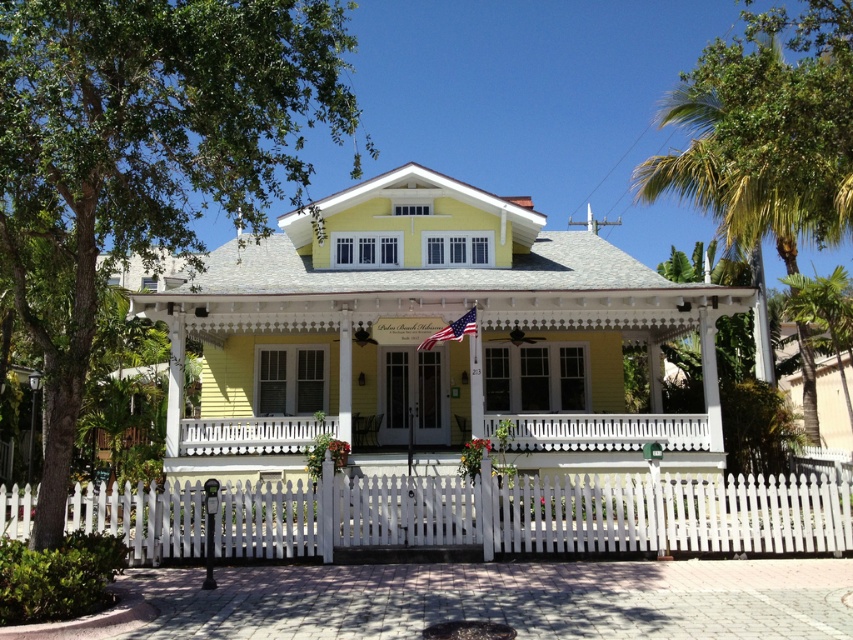
You are standing on the porch of the house and want to place a birdhouse between the green leafy palm tree at upper right and the green leafy palm tree at right. Which palm tree should you place the birdhouse closer to if you want it to be lower?

The green leafy palm tree at right is lower than the green leafy palm tree at upper right, so placing the birdhouse closer to the green leafy palm tree at right would make it lower.

You are a painter who needs to place a ladder on the white wooden porch at center to paint the house. The ladder is 1.5 meters wide. Can the ladder fit on the porch without overlapping the american flag at center?

The white wooden porch at center has a larger width than the american flag at center. Since the porch is wider, the ladder which is 1.5 meters wide can be placed on the porch without overlapping the flag as there is enough space.

You are a landscape architect designing a garden path that must pass between the green leafy palm tree at right and the american flag at center. The path must be at least 1 meter wide. Can you confirm if there is enough space between them?

The green leafy palm tree at right might be wider than the american flag at center, so the space between them may not be sufficient for a 1 meter wide path. Further measurements are needed to ensure adequate clearance.